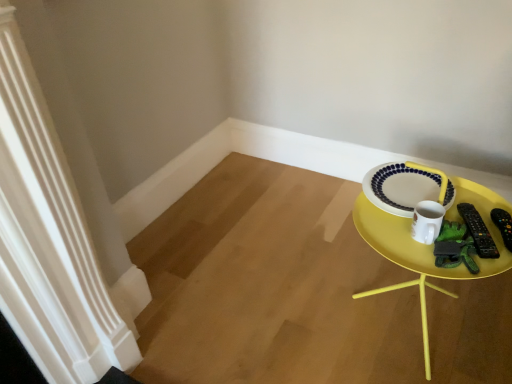
The image size is (512, 384). In order to click on vacant space positioned to the left of yellow plastic tray at right in this screenshot , I will do `click(291, 320)`.